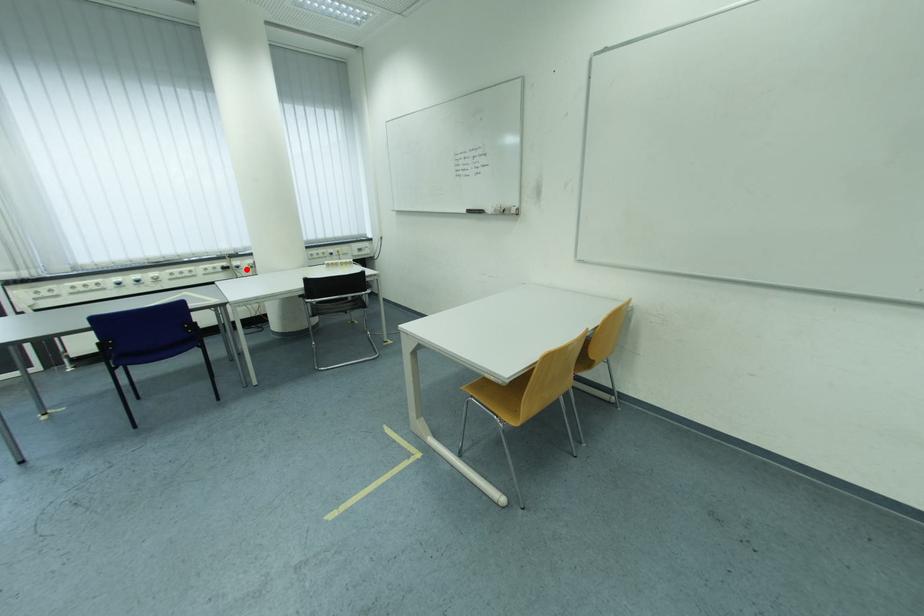
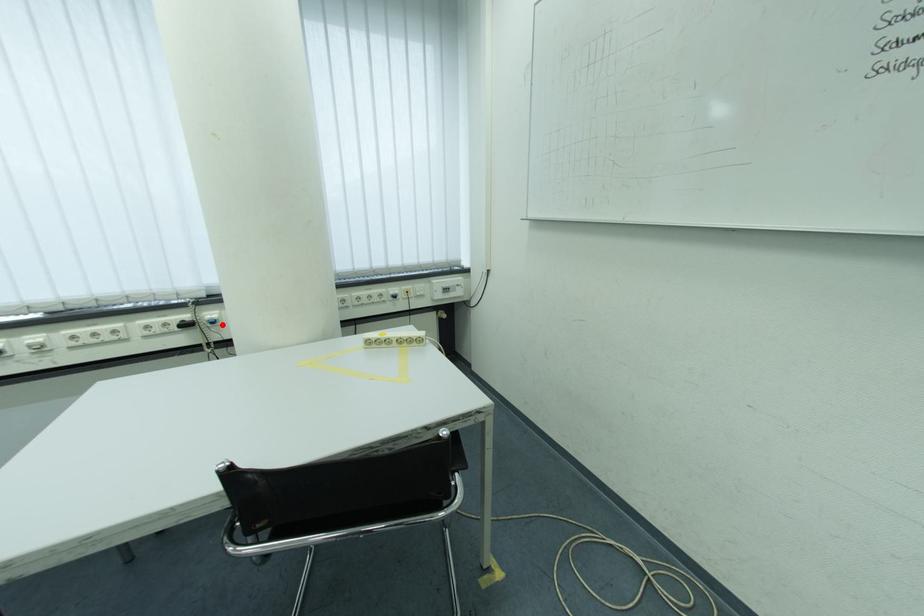
I am providing you with two images of the same scene from different viewpoints. A red point is marked on the first image and another point is marked on the second image. Is the marked point in image1 the same physical position as the marked point in image2?

Yes